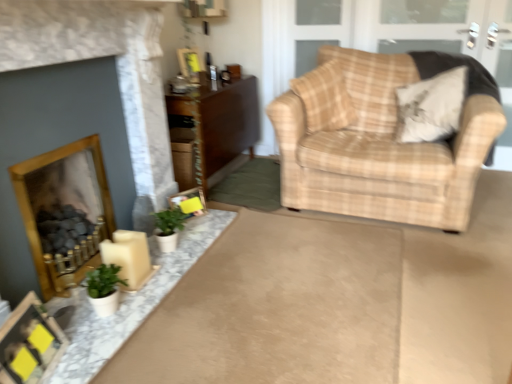
This screenshot has height=384, width=512. What do you see at coordinates (189, 63) in the screenshot? I see `wooden picture frame at upper center, marked as the first picture frame in a top-to-bottom arrangement` at bounding box center [189, 63].

What is the approximate height of plaid fabric pillow at upper right, placed as the 1th pillow when sorted from left to right?

plaid fabric pillow at upper right, placed as the 1th pillow when sorted from left to right, is 22.41 inches tall.

The width and height of the screenshot is (512, 384). I want to click on beige plaid armchair at right, so click(375, 145).

Locate an element on the screen. Image resolution: width=512 pixels, height=384 pixels. wooden fireplace at lower left, the first fireplace from the back is located at coordinates (65, 212).

At what (x,y) coordinates should I click in order to perform the action: click on wooden picture frame at upper center, which appears as the 3th picture frame when viewed from the front. Please return your answer as a coordinate pair (x, y). Image resolution: width=512 pixels, height=384 pixels. Looking at the image, I should click on (189, 63).

Considering the positions of objects green matte plant at lower left, which is counted as the 1th houseplant, starting from the back, and beige plaid armchair at right in the image provided, who is more to the left, green matte plant at lower left, which is counted as the 1th houseplant, starting from the back, or beige plaid armchair at right?

green matte plant at lower left, which is counted as the 1th houseplant, starting from the back.

Who is bigger, green matte plant at lower left, which is counted as the 1th houseplant, starting from the back, or beige plaid armchair at right?

beige plaid armchair at right is bigger.

Would you say green matte plant at lower left, positioned as the second houseplant in front-to-back order, is inside or outside beige plaid armchair at right?

green matte plant at lower left, positioned as the second houseplant in front-to-back order, is not enclosed by beige plaid armchair at right.

Does point (177, 236) come in front of point (393, 161)?

Yes, it is in front of point (393, 161).

From a real-world perspective, between green matte plant at lower left, which is counted as the 2th houseplant, starting from the back, and matte yellow picture frame at lower center, the first picture frame when ordered from right to left, who is vertically higher?

green matte plant at lower left, which is counted as the 2th houseplant, starting from the back, from a real-world perspective.

Is green matte plant at lower left, which is counted as the 2th houseplant, starting from the back, outside of matte yellow picture frame at lower center, the 3th picture frame positioned from the left?

green matte plant at lower left, which is counted as the 2th houseplant, starting from the back, lies outside matte yellow picture frame at lower center, the 3th picture frame positioned from the left,'s area.

In the scene shown: Is green matte plant at lower left, which appears as the first houseplant when viewed from the front, to the right of matte yellow picture frame at lower center, the first picture frame when ordered from right to left, from the viewer's perspective?

No.

Can you confirm if wooden fireplace at lower left, the first fireplace from the back, is wider than matte black picture frame at lower left, the first picture frame in the front-to-back sequence?

Yes, wooden fireplace at lower left, the first fireplace from the back, is wider than matte black picture frame at lower left, the first picture frame in the front-to-back sequence.

Does wooden fireplace at lower left, the 2th fireplace viewed from the front, appear on the left side of matte black picture frame at lower left, the third picture frame when ordered from back to front?

Indeed, wooden fireplace at lower left, the 2th fireplace viewed from the front, is positioned on the left side of matte black picture frame at lower left, the third picture frame when ordered from back to front.

From the image's perspective, is wooden fireplace at lower left, the first fireplace from the back, located above or below matte black picture frame at lower left, placed as the 3th picture frame when sorted from top to bottom?

Clearly, from the image's perspective, wooden fireplace at lower left, the first fireplace from the back, is above matte black picture frame at lower left, placed as the 3th picture frame when sorted from top to bottom.

Is white matte candle at lower left positioned beyond the bounds of green matte plant at lower left, which is counted as the 1th houseplant, starting from the back?

Yes, white matte candle at lower left is located beyond the bounds of green matte plant at lower left, which is counted as the 1th houseplant, starting from the back.

Measure the distance from white matte candle at lower left to green matte plant at lower left, positioned as the second houseplant in front-to-back order.

white matte candle at lower left is 9.31 inches away from green matte plant at lower left, positioned as the second houseplant in front-to-back order.

From the image's perspective, between white matte candle at lower left and green matte plant at lower left, which is counted as the 1th houseplant, starting from the back, who is located below?

From the image's view, white matte candle at lower left is below.

Is white matte candle at lower left thinner than green matte plant at lower left, positioned as the second houseplant in front-to-back order?

No, white matte candle at lower left is not thinner than green matte plant at lower left, positioned as the second houseplant in front-to-back order.

Is beige fabric pillow at upper right, the 1th pillow viewed from the right, wider or thinner than white matte candle at lower left?

Considering their sizes, beige fabric pillow at upper right, the 1th pillow viewed from the right, looks broader than white matte candle at lower left.

Between point (426, 80) and point (135, 261), which one is positioned in front?

The point (135, 261) is in front.

Find the location of a particular element. The image size is (512, 384). the 1st pillow behind the white matte candle at lower left is located at coordinates (431, 106).

Based on their sizes in the image, would you say beige fabric pillow at upper right, the 2th pillow when ordered from left to right, is bigger or smaller than white matte candle at lower left?

Clearly, beige fabric pillow at upper right, the 2th pillow when ordered from left to right, is larger in size than white matte candle at lower left.

Does beige plaid armchair at right have a larger size compared to matte gold fireplace at left, placed as the 2th fireplace when sorted from back to front?

Yes, beige plaid armchair at right is bigger than matte gold fireplace at left, placed as the 2th fireplace when sorted from back to front.

Where is `fireplace located above the beige plaid armchair at right (from a real-world perspective)`? Image resolution: width=512 pixels, height=384 pixels. fireplace located above the beige plaid armchair at right (from a real-world perspective) is located at coordinates (116, 69).

Which object is thinner, beige plaid armchair at right or matte gold fireplace at left, which ranks as the first fireplace in front-to-back order?

matte gold fireplace at left, which ranks as the first fireplace in front-to-back order, is thinner.

Considering the positions of point (337, 117) and point (138, 202), is point (337, 117) closer or farther from the camera than point (138, 202)?

Clearly, point (337, 117) is more distant from the camera than point (138, 202).

Is green matte plant at lower left, which is counted as the 2th houseplant, starting from the back, far away from brown wood cabinet at center?

Yes, green matte plant at lower left, which is counted as the 2th houseplant, starting from the back, is far from brown wood cabinet at center.

Is green matte plant at lower left, which is counted as the 2th houseplant, starting from the back, not inside brown wood cabinet at center?

Yes.

Looking at this image, is green matte plant at lower left, which appears as the first houseplant when viewed from the front, to the left of brown wood cabinet at center from the viewer's perspective?

Yes, green matte plant at lower left, which appears as the first houseplant when viewed from the front, is to the left of brown wood cabinet at center.

Is green matte plant at lower left, which appears as the first houseplant when viewed from the front, oriented away from brown wood cabinet at center?

No, green matte plant at lower left, which appears as the first houseplant when viewed from the front, is not facing away from brown wood cabinet at center.

Locate an element on the screen. The image size is (512, 384). chair above the green matte plant at lower left, positioned as the second houseplant in front-to-back order (from the image's perspective) is located at coordinates (375, 145).

Starting from the green matte plant at lower left, which appears as the first houseplant when viewed from the front, which picture frame is the 1st one behind? Please provide its 2D coordinates.

[(189, 201)]

Based on their spatial positions, is beige fabric pillow at upper right, the 1th pillow viewed from the right, or matte yellow picture frame at lower center, placed as the second picture frame when sorted from back to front, closer to wooden picture frame at upper center, positioned as the first picture frame in back-to-front order?

matte yellow picture frame at lower center, placed as the second picture frame when sorted from back to front, lies closer to wooden picture frame at upper center, positioned as the first picture frame in back-to-front order, than the other object.

Considering their positions, is beige fabric pillow at upper right, the 2th pillow when ordered from left to right, positioned closer to matte black picture frame at lower left, the first picture frame in the front-to-back sequence, than white matte candle at lower left?

Among the two, white matte candle at lower left is located nearer to matte black picture frame at lower left, the first picture frame in the front-to-back sequence.

Based on their spatial positions, is wooden fireplace at lower left, the first fireplace from the back, or plaid fabric pillow at upper right, placed as the 1th pillow when sorted from left to right, further from white matte candle at lower left?

plaid fabric pillow at upper right, placed as the 1th pillow when sorted from left to right, lies further to white matte candle at lower left than the other object.

Estimate the real-world distances between objects in this image. Which object is closer to wooden fireplace at lower left, the 2th fireplace viewed from the front, matte black picture frame at lower left, the first picture frame in the front-to-back sequence, or matte yellow picture frame at lower center, placed as the second picture frame when sorted from top to bottom?

matte black picture frame at lower left, the first picture frame in the front-to-back sequence, is positioned closer to the anchor wooden fireplace at lower left, the 2th fireplace viewed from the front.

Looking at the image, which one is located further to white matte candle at lower left, matte yellow picture frame at lower center, placed as the second picture frame when sorted from back to front, or brown wood cabinet at center?

Among the two, brown wood cabinet at center is located further to white matte candle at lower left.

Looking at the image, which one is located further to wooden fireplace at lower left, the 2th fireplace viewed from the front, green matte plant at lower left, which appears as the first houseplant when viewed from the front, or white matte candle at lower left?

green matte plant at lower left, which appears as the first houseplant when viewed from the front, is positioned further to the anchor wooden fireplace at lower left, the 2th fireplace viewed from the front.

Estimate the real-world distances between objects in this image. Which object is further from wooden fireplace at lower left, the first fireplace from the back, plaid fabric pillow at upper right, placed as the 1th pillow when sorted from left to right, or beige fabric pillow at upper right, the 1th pillow viewed from the right?

beige fabric pillow at upper right, the 1th pillow viewed from the right, is further to wooden fireplace at lower left, the first fireplace from the back.

Based on their spatial positions, is brown wood cabinet at center or plaid fabric pillow at upper right, placed as the 1th pillow when sorted from left to right, closer to matte black picture frame at lower left, the third picture frame when ordered from back to front?

The object closer to matte black picture frame at lower left, the third picture frame when ordered from back to front, is brown wood cabinet at center.

Locate an element on the screen. This screenshot has width=512, height=384. pillow between matte black picture frame at lower left, the third picture frame when ordered from back to front, and beige fabric pillow at upper right, the 1th pillow viewed from the right, from left to right is located at coordinates (325, 97).

At what (x,y) coordinates should I click in order to perform the action: click on chair between brown wood cabinet at center and beige fabric pillow at upper right, the 1th pillow viewed from the right, in the horizontal direction. Please return your answer as a coordinate pair (x, y). The width and height of the screenshot is (512, 384). Looking at the image, I should click on (375, 145).

Locate an element on the screen. candle situated between matte black picture frame at lower left, the third picture frame when ordered from back to front, and plaid fabric pillow at upper right, placed as the second pillow when sorted from right to left, from left to right is located at coordinates (129, 257).

This screenshot has width=512, height=384. I want to click on candle between green matte plant at lower left, which is counted as the 2th houseplant, starting from the back, and beige fabric pillow at upper right, the 2th pillow when ordered from left to right, from left to right, so click(x=129, y=257).